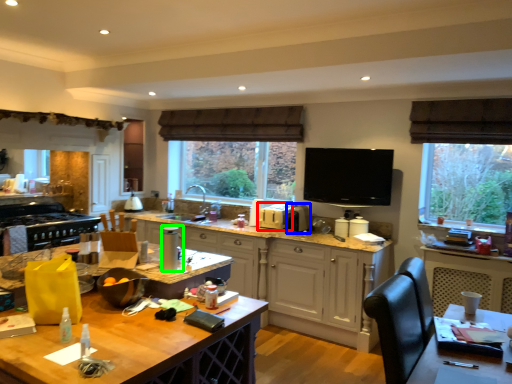
Question: Based on their relative distances, which object is farther from appliance (highlighted by a red box)? Choose from appliance (highlighted by a blue box) and appliance (highlighted by a green box).

Choices:
 (A) appliance
 (B) appliance

Answer: (B)